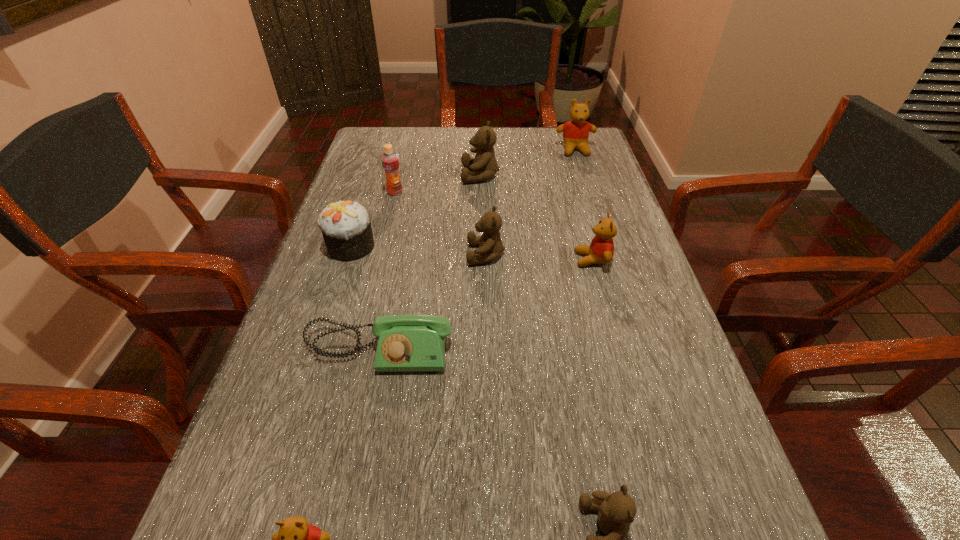
Identify which red teddy bear is the second closest to the leftmost teddy bear. Please provide its 2D coordinates. Your answer should be formatted as a tuple, i.e. [(x, y)], where the tuple contains the x and y coordinates of a point satisfying the conditions above.

[(576, 131)]

The height and width of the screenshot is (540, 960). I want to click on the third closest red teddy bear relative to the second farthest brown teddy bear, so click(x=296, y=539).

The height and width of the screenshot is (540, 960). Find the location of `vacant position in the image that satisfies the following two spatial constraints: 1. on the front-facing side of the second nearest red teddy bear; 2. on the dial of the telephone`. vacant position in the image that satisfies the following two spatial constraints: 1. on the front-facing side of the second nearest red teddy bear; 2. on the dial of the telephone is located at coordinates (617, 350).

Locate an element on the screen. The image size is (960, 540). free space that satisfies the following two spatial constraints: 1. on the front-facing side of the second smallest red teddy bear; 2. on the dial of the seventh farthest object is located at coordinates (617, 350).

Where is `free space that satisfies the following two spatial constraints: 1. on the front-facing side of the farthest object; 2. on the front-facing side of the second smallest red teddy bear`? The height and width of the screenshot is (540, 960). free space that satisfies the following two spatial constraints: 1. on the front-facing side of the farthest object; 2. on the front-facing side of the second smallest red teddy bear is located at coordinates (610, 259).

The width and height of the screenshot is (960, 540). Identify the location of blank area in the image that satisfies the following two spatial constraints: 1. on the front-facing side of the farthest red teddy bear; 2. on the front-facing side of the second biggest brown teddy bear. (609, 254).